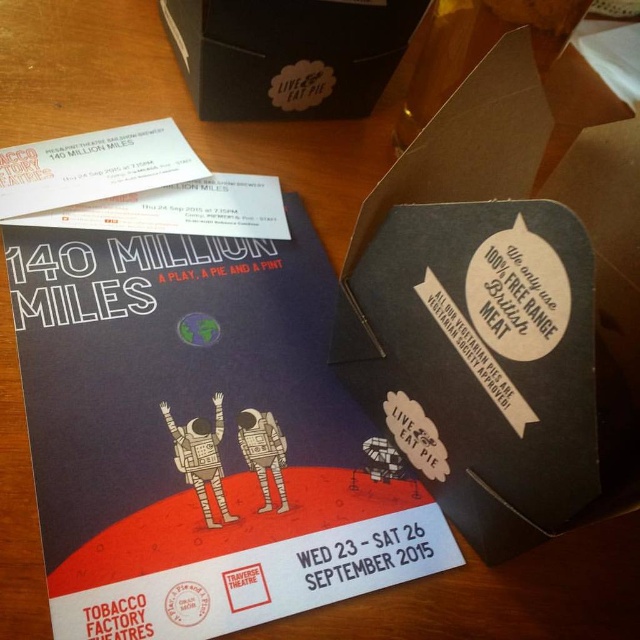
Question: Does matte black poster at center have a greater width compared to wooden astronaut at center?

Choices:
 (A) no
 (B) yes

Answer: (B)

Question: From the image, what is the correct spatial relationship of matte black poster at center in relation to wooden astronaut at center?

Choices:
 (A) above
 (B) below

Answer: (A)

Question: Does wooden astronaut at center have a smaller size compared to matte gray astronaut at center?

Choices:
 (A) no
 (B) yes

Answer: (A)

Question: Estimate the real-world distances between objects in this image. Which object is farther from the matte black poster at center?

Choices:
 (A) wooden astronaut at center
 (B) matte gray astronaut at center

Answer: (B)

Question: Among these objects, which one is nearest to the camera?

Choices:
 (A) matte black poster at center
 (B) wooden astronaut at center
 (C) matte gray astronaut at center

Answer: (A)

Question: Which of the following is the farthest from the observer?

Choices:
 (A) (241, 435)
 (B) (205, 524)

Answer: (A)